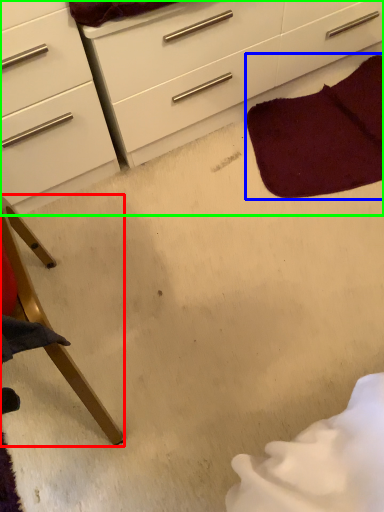
Question: Which is nearer to the furniture (highlighted by a red box)? blanket (highlighted by a blue box) or chest of drawers (highlighted by a green box).

Choices:
 (A) blanket
 (B) chest of drawers

Answer: (B)